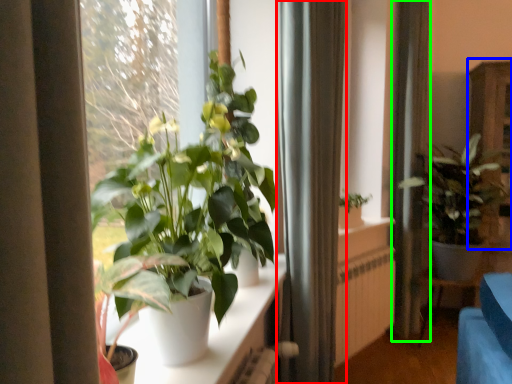
Question: Which object is the closest to the curtain (highlighted by a red box)? Choose among these: dresser (highlighted by a blue box) or curtain (highlighted by a green box).

Choices:
 (A) dresser
 (B) curtain

Answer: (B)